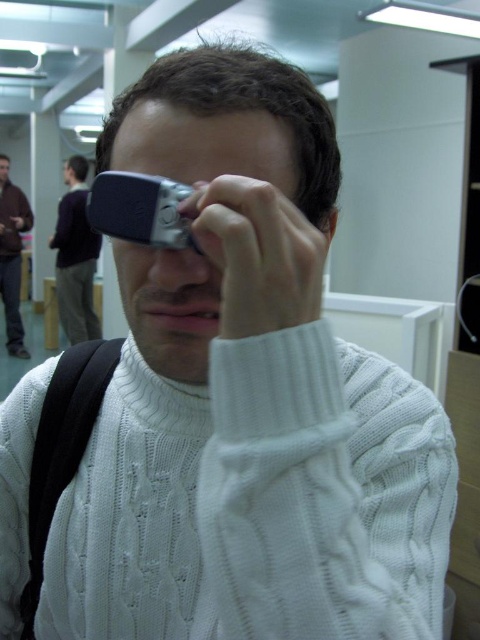
You are an interior designer assessing the layout of the indoor space. You notice the dark purple sweater at upper left and the brown leather jacket at left. Which item is placed lower in the image?

The dark purple sweater at upper left is positioned under the brown leather jacket at left, so it is placed lower in the image.

You are an AI analyzing the image. The dark purple sweater at upper left is located at coordinates. What are its coordinates?

The dark purple sweater at upper left is located at coordinates point [75,257].

You are standing in the scene and want to determine which of the two points, point [80,232] or point [24,348], is nearer to you. Based on the description, which point is closer?

Point [80,232] is closer to the viewer than point [24,348].